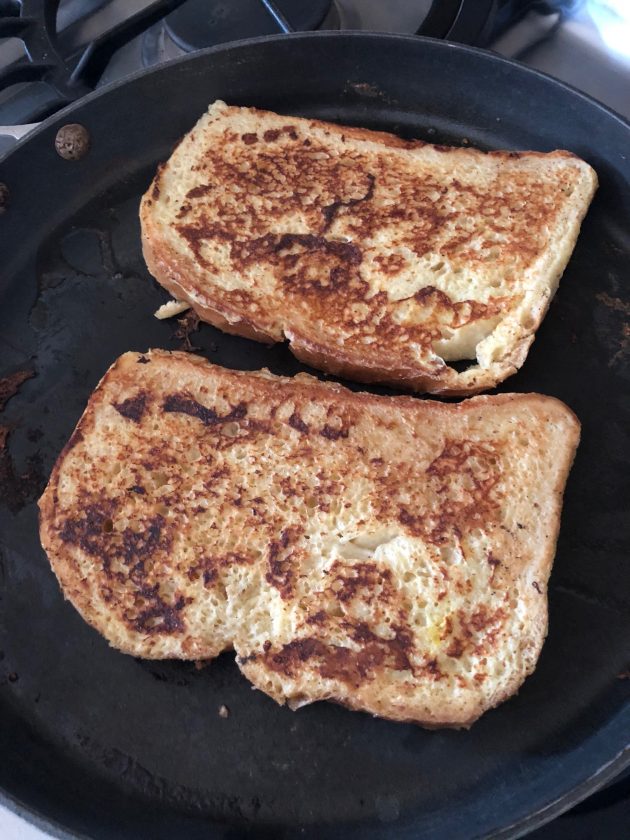
You are a GUI agent. You are given a task and a screenshot of the screen. Output one action in this format:
    pyautogui.click(x=<x>, y=<y>)
    Task: Click on the inside of frying pan
    
    Given the screenshot: What is the action you would take?
    pyautogui.click(x=183, y=753)